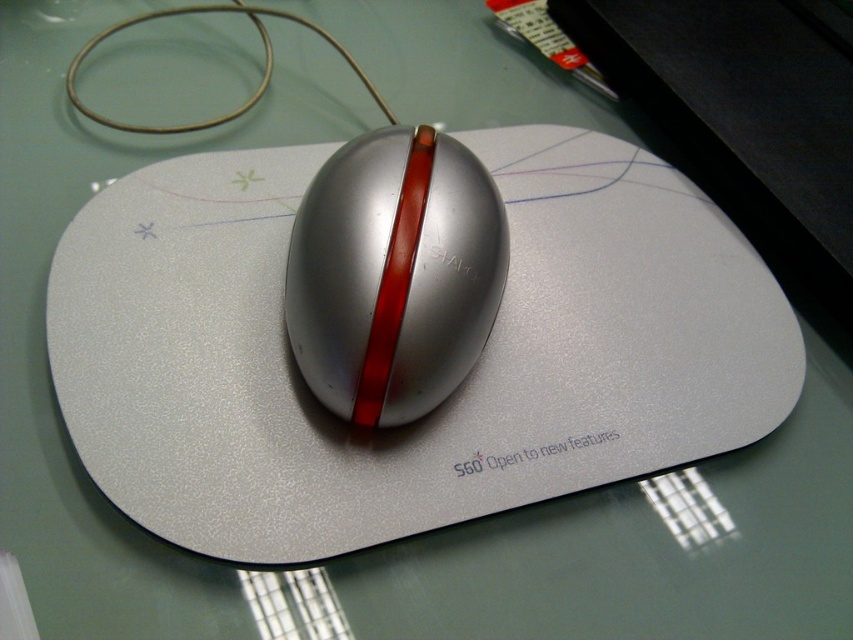
Does silver textured mousepad at center have a lesser height compared to metallic silver mouse at center?

No, silver textured mousepad at center is not shorter than metallic silver mouse at center.

Does silver textured mousepad at center have a lesser width compared to metallic silver mouse at center?

No, silver textured mousepad at center is not thinner than metallic silver mouse at center.

At what (x,y) coordinates should I click in order to perform the action: click on silver textured mousepad at center. Please return your answer as a coordinate pair (x, y). The image size is (853, 640). Looking at the image, I should click on (453, 394).